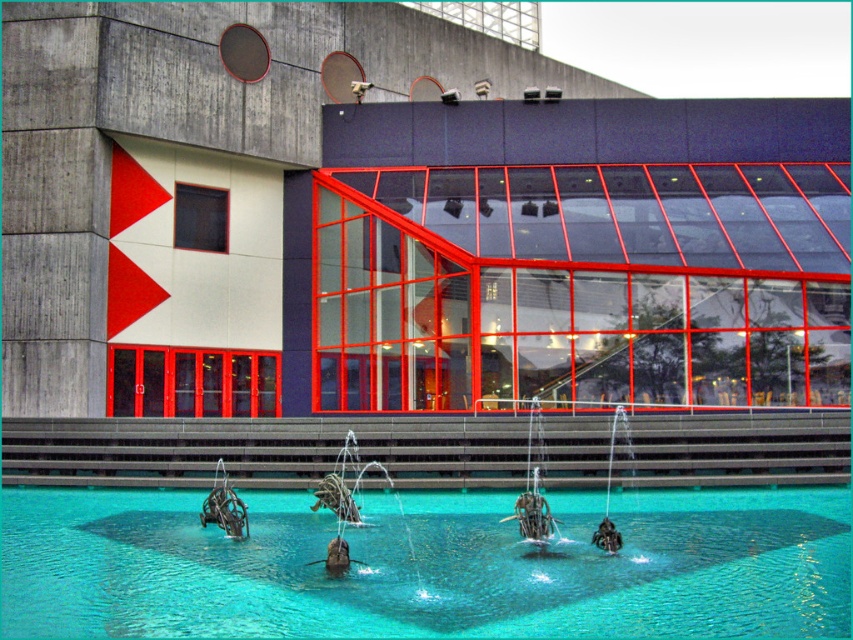
Question: Which point appears closest to the camera in this image?

Choices:
 (A) (462, 508)
 (B) (218, 520)

Answer: (B)

Question: Is clear glass swimming pool at center to the right of metallic sculpture at lower center from the viewer's perspective?

Choices:
 (A) yes
 (B) no

Answer: (A)

Question: Which of these objects is positioned closest to the metallic sculpture at lower center?

Choices:
 (A) metallic silver sculpture at center
 (B) clear glass swimming pool at center

Answer: (B)

Question: Is metallic silver sculpture at center below metallic sculpture at lower center?

Choices:
 (A) no
 (B) yes

Answer: (A)

Question: Which object is farther from the camera taking this photo?

Choices:
 (A) clear glass swimming pool at center
 (B) metallic sculpture at lower center
 (C) metallic silver sculpture at center

Answer: (B)

Question: Does clear glass swimming pool at center have a lesser width compared to metallic sculpture at lower center?

Choices:
 (A) yes
 (B) no

Answer: (B)